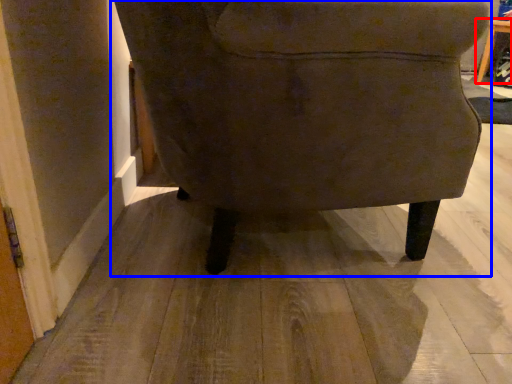
Question: Which object is further to the camera taking this photo, table (highlighted by a red box) or chair (highlighted by a blue box)?

Choices:
 (A) table
 (B) chair

Answer: (A)